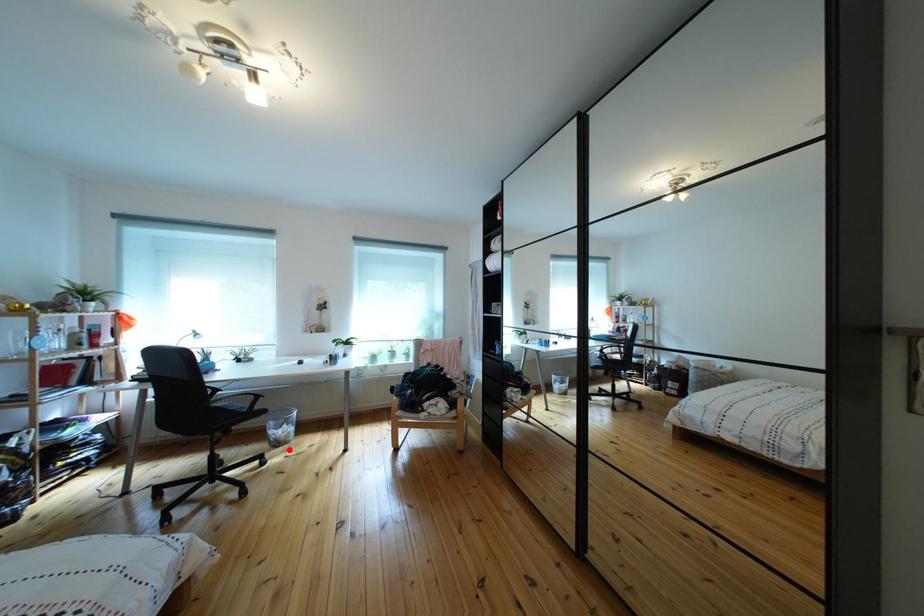
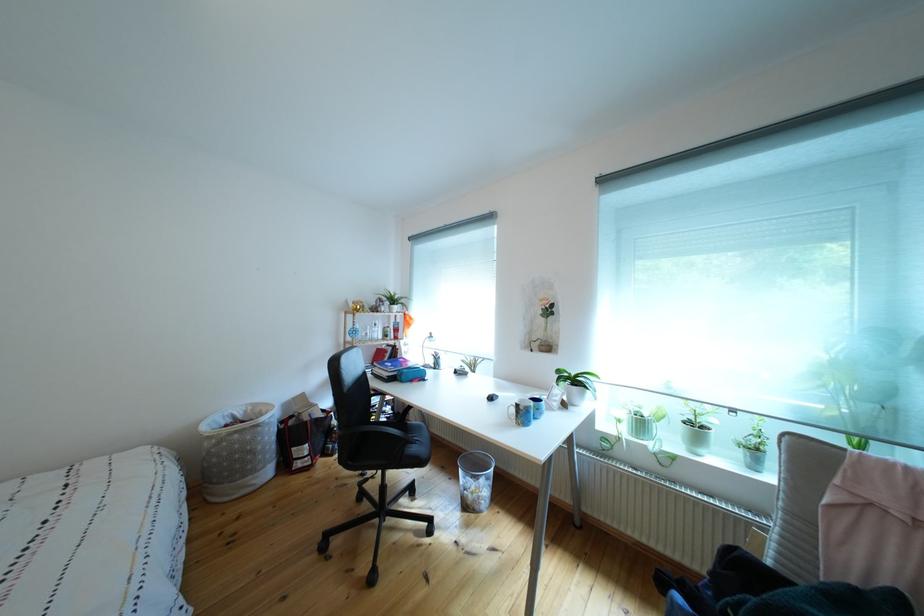
The point at the highlighted location is marked in the first image. Where is the corresponding point in the second image?

(477, 512)